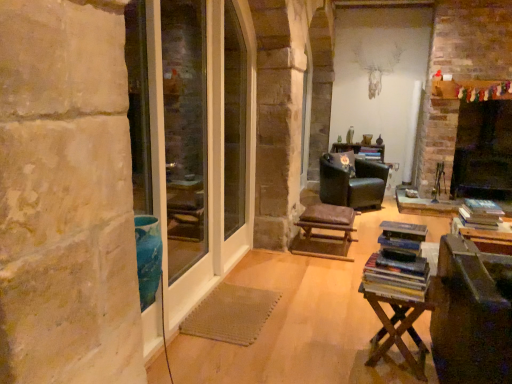
Where is `vacant area situated below wooden table at lower right (from a real-world perspective)`? The width and height of the screenshot is (512, 384). vacant area situated below wooden table at lower right (from a real-world perspective) is located at coordinates (392, 355).